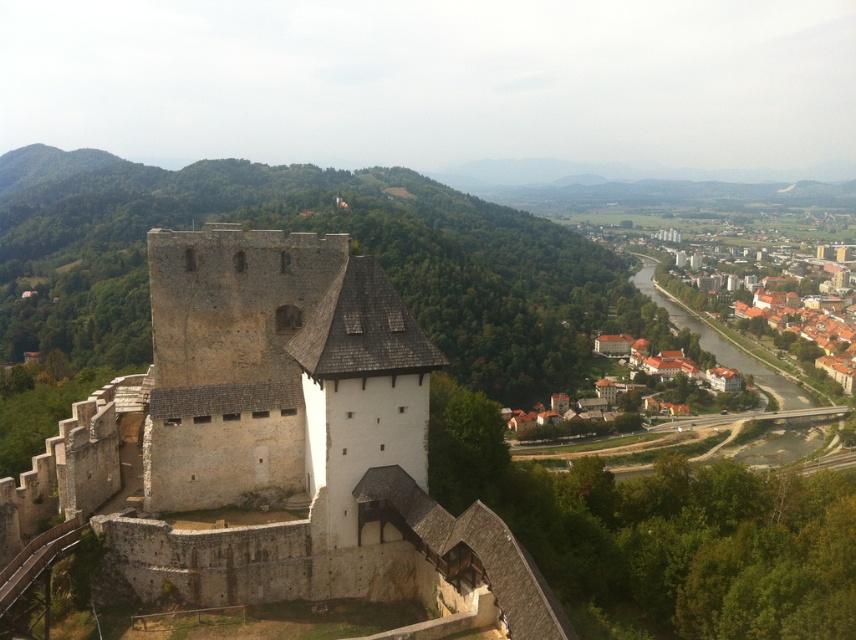
You are a tourist standing at the base of the hill looking up at the white stone castle at center and the brown tiled roofs at lower right. Which structure appears closer to you based on their sizes?

The white stone castle at center appears closer because it is smaller in size compared to the brown tiled roofs at lower right, which are farther away.